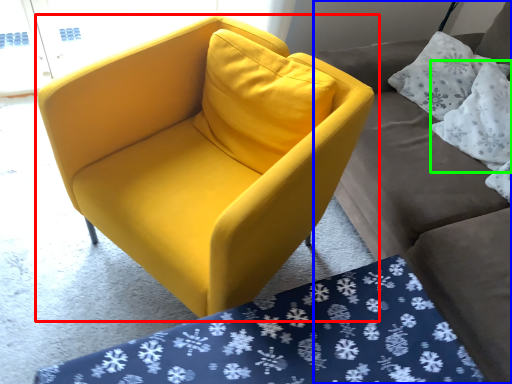
Question: Which is farther away from chair (highlighted by a red box)? studio couch (highlighted by a blue box) or pillow (highlighted by a green box)?

Choices:
 (A) studio couch
 (B) pillow

Answer: (B)